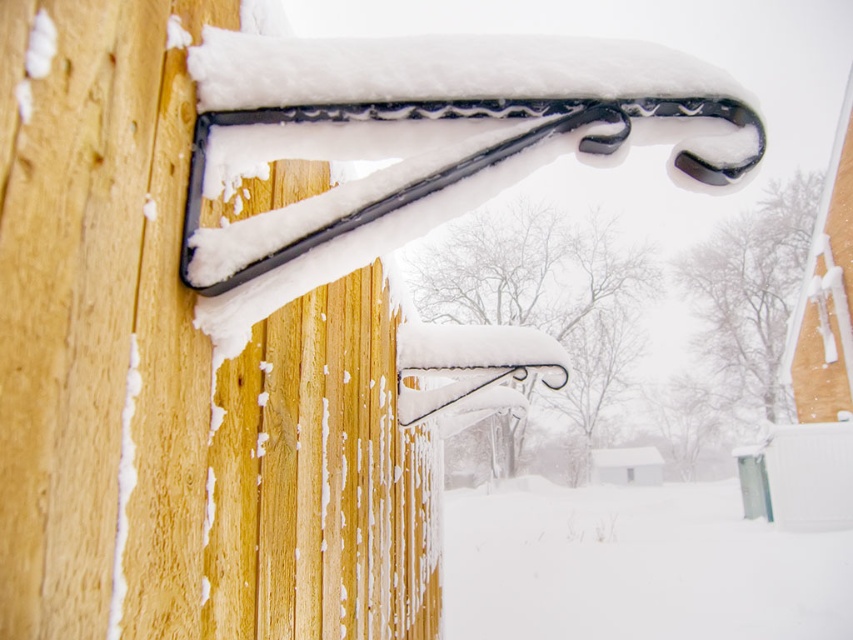
Question: Can you confirm if wooden fence at left is wider than white fluffy snow at lower center?

Choices:
 (A) no
 (B) yes

Answer: (A)

Question: Which point appears farthest from the camera in this image?

Choices:
 (A) (79, 628)
 (B) (631, 488)

Answer: (B)

Question: Does wooden fence at left appear under white fluffy snow at lower center?

Choices:
 (A) yes
 (B) no

Answer: (B)

Question: Which point is farther to the camera?

Choices:
 (A) white fluffy snow at lower center
 (B) wooden fence at left

Answer: (A)

Question: Does wooden fence at left come behind white fluffy snow at lower center?

Choices:
 (A) no
 (B) yes

Answer: (A)

Question: Which point appears closest to the camera in this image?

Choices:
 (A) (x=403, y=529)
 (B) (x=773, y=531)

Answer: (A)